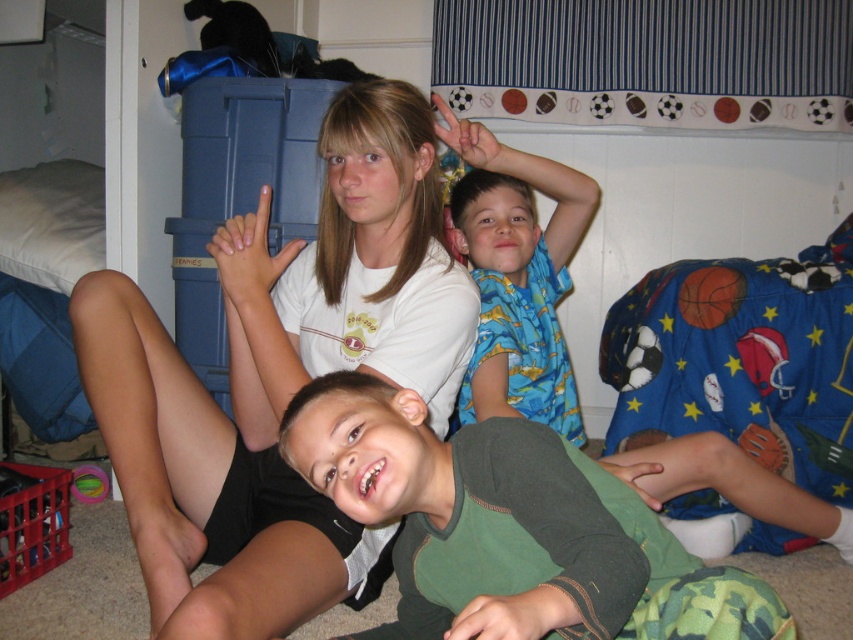
Which is behind, point (647, 488) or point (97, 484)?

The point (97, 484) is more distant.

Who is positioned more to the left, blue pajama at upper right or green rubber ball at lower left?

From the viewer's perspective, green rubber ball at lower left appears more on the left side.

Which is behind, point (656, 436) or point (91, 486)?

Point (91, 486)

Find the location of a particular element. The width and height of the screenshot is (853, 640). blue pajama at upper right is located at coordinates point(515,208).

Can you confirm if white matte shirt at upper center is positioned above green rubber ball at lower left?

Yes.

How far apart are white matte shirt at upper center and green rubber ball at lower left?

white matte shirt at upper center and green rubber ball at lower left are 38.70 inches apart from each other.

What do you see at coordinates (280, 380) in the screenshot?
I see `white matte shirt at upper center` at bounding box center [280, 380].

Identify the location of white matte shirt at upper center. (280, 380).

Looking at this image, who is more distant from viewer, (403,442) or (103,484)?

Point (103,484)

Does green soft shirt at center have a greater width compared to green rubber ball at lower left?

Correct, the width of green soft shirt at center exceeds that of green rubber ball at lower left.

Who is more forward, (521,572) or (91,492)?

Positioned in front is point (521,572).

Find the location of a particular element. green soft shirt at center is located at coordinates (509, 525).